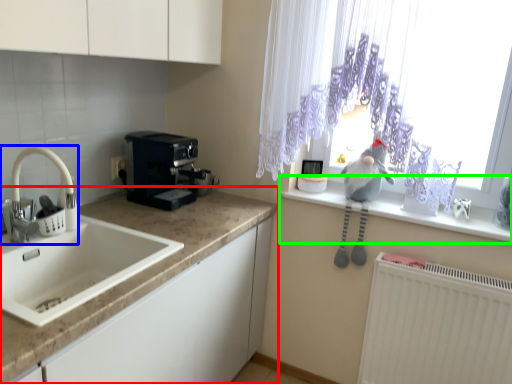
Question: Considering the real-world distances, which object is closest to countertop (highlighted by a red box)? tap (highlighted by a blue box) or window sill (highlighted by a green box).

Choices:
 (A) tap
 (B) window sill

Answer: (A)